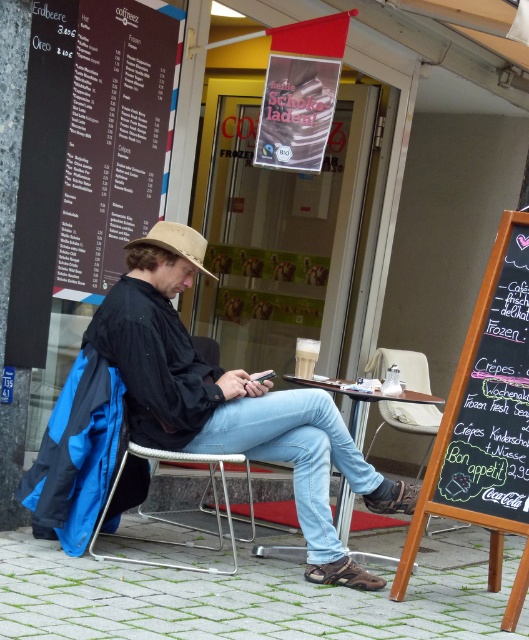
You are standing at the entrance of the cafe and see the brown paper menu at left. Can you tell me what is located at point (80,148)?

The brown paper menu at left is located at point (80,148).

You are a customer at the cafe and want to read the brown paper menu at left while sitting on the metallic wire chair at center. Can you comfortably read the menu without moving your chair?

The brown paper menu at left has a larger size compared to metallic wire chair at center, so it should be easy to read comfortably while sitting on the chair without needing to move it.